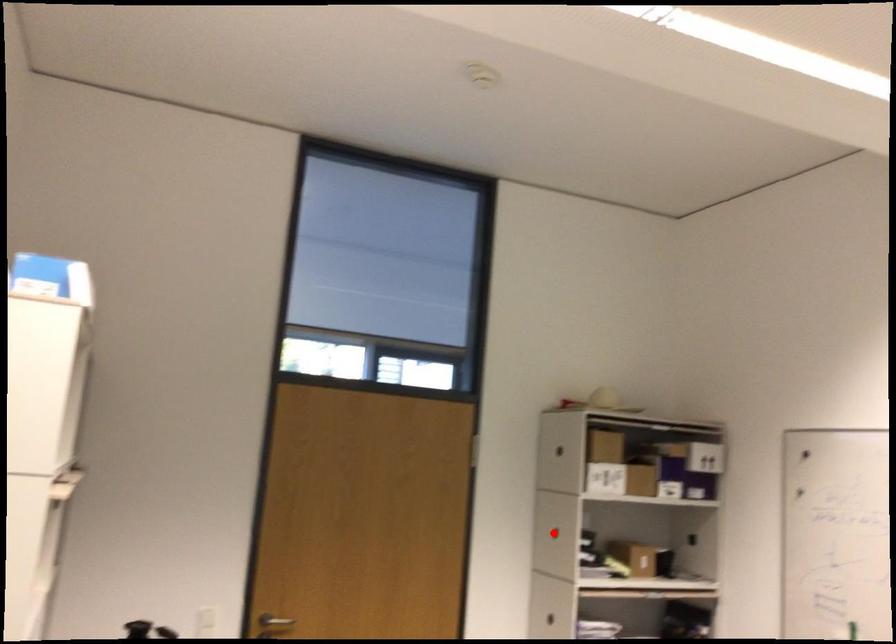
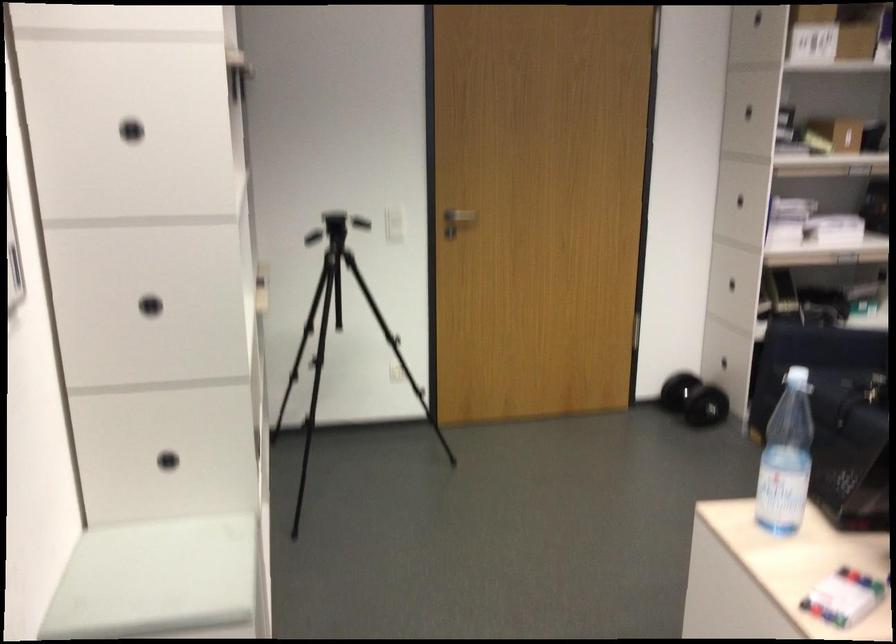
Find the pixel in the second image that matches the highlighted location in the first image.

(747, 111)